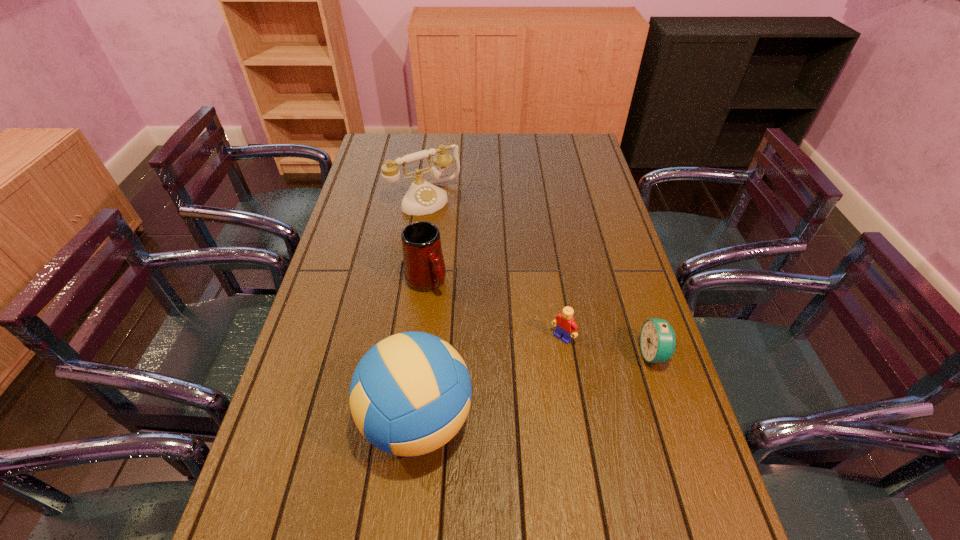
The image size is (960, 540). Find the location of `object that is at the right edge`. object that is at the right edge is located at coordinates (657, 338).

Locate an element on the screen. The height and width of the screenshot is (540, 960). vacant position at the far edge of the desktop is located at coordinates (511, 164).

The width and height of the screenshot is (960, 540). In the image, there is a desktop. Find the location of `vacant space at the near edge`. vacant space at the near edge is located at coordinates [525, 477].

At what (x,y) coordinates should I click in order to perform the action: click on free spot at the left edge of the desktop. Please return your answer as a coordinate pair (x, y). Looking at the image, I should click on (339, 387).

Identify the location of blank area at the right edge. (601, 263).

Locate an element on the screen. The image size is (960, 540). vacant point at the far right corner is located at coordinates (591, 161).

Identify the location of vacant space that is in between the alarm clock and the fourth nearest object. (540, 318).

The width and height of the screenshot is (960, 540). I want to click on vacant space in between the telephone and the alarm clock, so click(x=540, y=276).

Identify the location of vacant space that is in between the mug and the alarm clock. (540, 318).

You are a GUI agent. You are given a task and a screenshot of the screen. Output one action in this format:
    pyautogui.click(x=<x>, y=<y>)
    Task: Click on the unoccupied position between the Lego and the tallest object
    The image size is (960, 540).
    Given the screenshot: What is the action you would take?
    tap(491, 379)